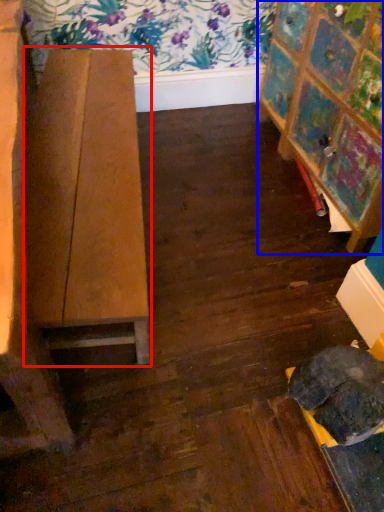
Question: Which object appears closest to the camera in this image, table (highlighted by a red box) or furniture (highlighted by a blue box)?

Choices:
 (A) table
 (B) furniture

Answer: (A)